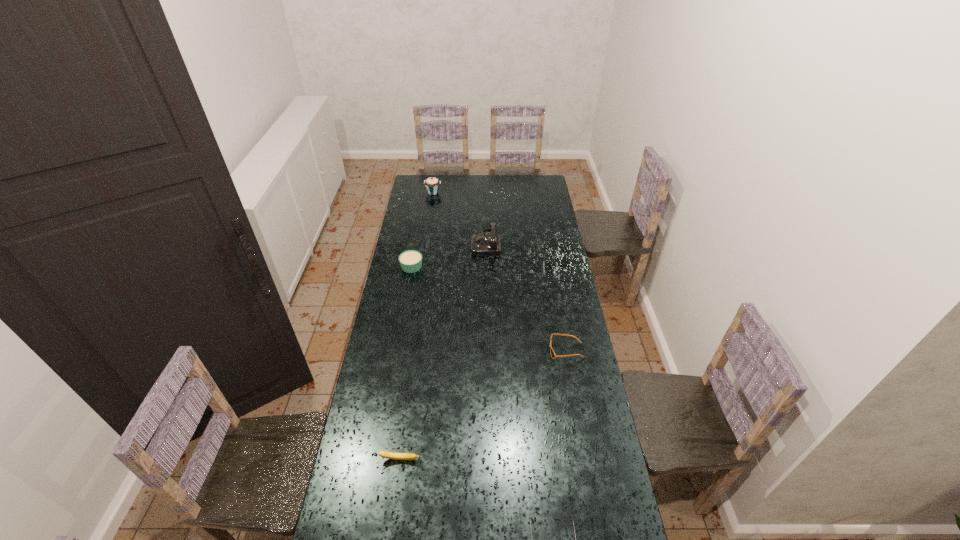
Locate an element on the screen. This screenshot has height=540, width=960. free space between the taller cupcake and the nearer cupcake is located at coordinates (422, 230).

The height and width of the screenshot is (540, 960). I want to click on vacant area that lies between the right sunglasses and the fourth shortest object, so click(489, 309).

Identify the location of vacant area between the banana and the taller sunglasses. This screenshot has width=960, height=540. (483, 405).

Find the location of a particular element. The image size is (960, 540). vacant space in between the taller sunglasses and the fourth object from left to right is located at coordinates (526, 297).

At what (x,y) coordinates should I click in order to perform the action: click on object that stands as the second closest to the right sunglasses. Please return your answer as a coordinate pair (x, y). Looking at the image, I should click on (482, 244).

Identify which object is the second closest to the fourth shortest object. Please provide its 2D coordinates. Your answer should be formatted as a tuple, i.e. [(x, y)], where the tuple contains the x and y coordinates of a point satisfying the conditions above.

[(432, 184)]

The image size is (960, 540). In order to click on free region that satisfies the following two spatial constraints: 1. on the dial of the fourth object from left to right; 2. at the stem of the second nearest object in this screenshot , I will do `click(490, 460)`.